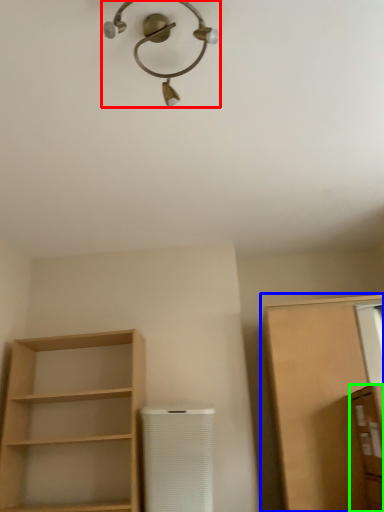
Question: Considering the real-world distances, which object is closest to light fixture (highlighted by a red box)? cabinetry (highlighted by a blue box) or cabinetry (highlighted by a green box).

Choices:
 (A) cabinetry
 (B) cabinetry

Answer: (A)